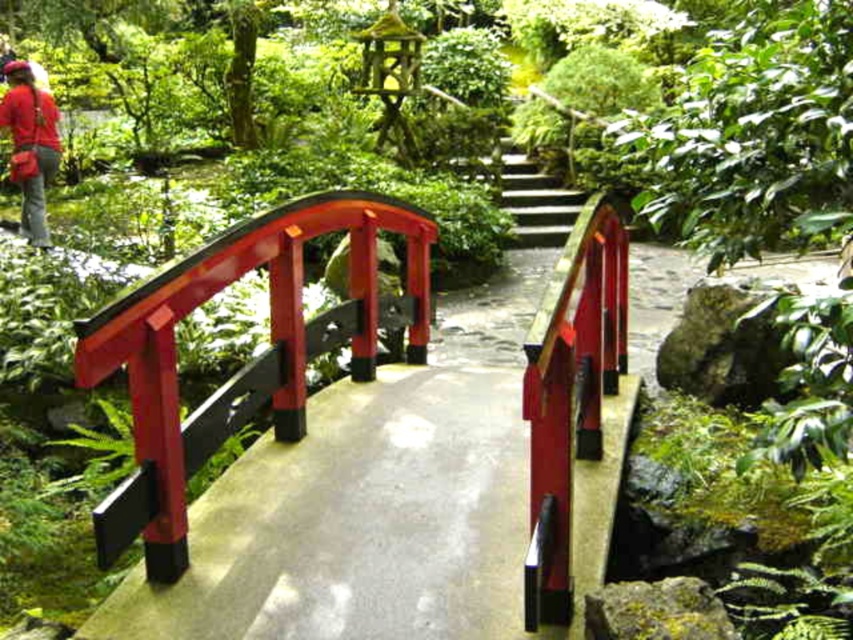
Does glossy wood bridge at center have a lesser width compared to matte red shirt at upper left?

Incorrect, glossy wood bridge at center's width is not less than matte red shirt at upper left's.

Does glossy wood bridge at center have a lesser height compared to matte red shirt at upper left?

Yes.

Identify the location of glossy wood bridge at center. Image resolution: width=853 pixels, height=640 pixels. (247, 364).

I want to click on glossy wood bridge at center, so click(x=247, y=364).